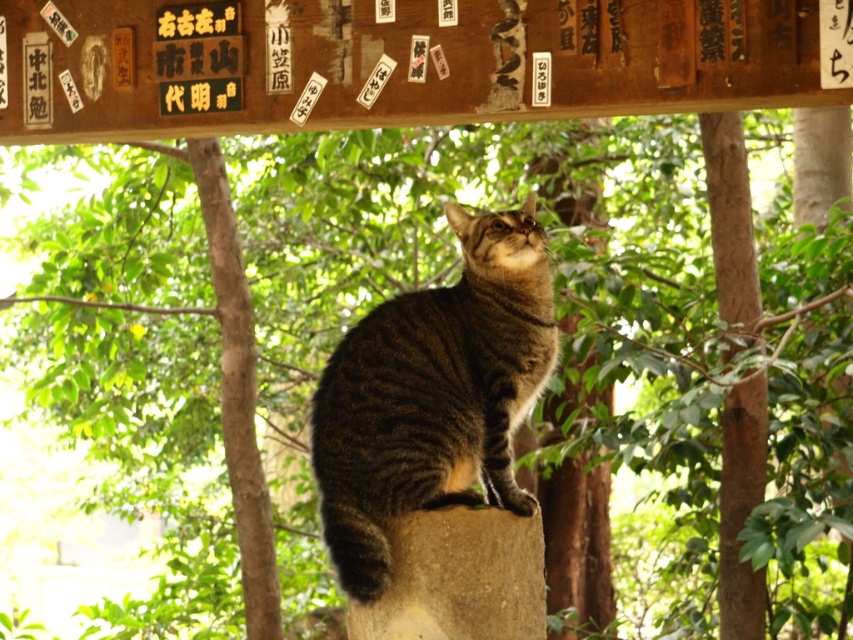
Question: Is tabby fur cat at center wider than brown rough stone at center?

Choices:
 (A) yes
 (B) no

Answer: (A)

Question: Which of the following is the closest to the observer?

Choices:
 (A) (476, 620)
 (B) (534, 300)

Answer: (A)

Question: Which object appears farthest from the camera in this image?

Choices:
 (A) tabby fur cat at center
 (B) brown rough stone at center

Answer: (B)

Question: Can you confirm if tabby fur cat at center is thinner than brown rough stone at center?

Choices:
 (A) yes
 (B) no

Answer: (B)

Question: Is tabby fur cat at center above brown rough stone at center?

Choices:
 (A) no
 (B) yes

Answer: (B)